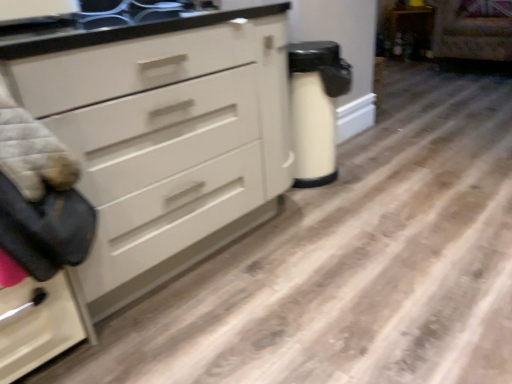
Question: Does point (144, 175) appear closer or farther from the camera than point (389, 13)?

Choices:
 (A) closer
 (B) farther

Answer: (A)

Question: Relative to wooden cabinet at upper right, is white matte chest of drawers at center in front or behind?

Choices:
 (A) front
 (B) behind

Answer: (A)

Question: Considering the real-world distances, which object is farthest from the velvet-like beige armchair at upper right?

Choices:
 (A) wooden cabinet at upper right
 (B) black glossy sink at upper center
 (C) white matte chest of drawers at center

Answer: (C)

Question: Based on their relative distances, which object is farther from the white matte chest of drawers at center?

Choices:
 (A) wooden cabinet at upper right
 (B) velvet-like beige armchair at upper right
 (C) black glossy sink at upper center

Answer: (A)